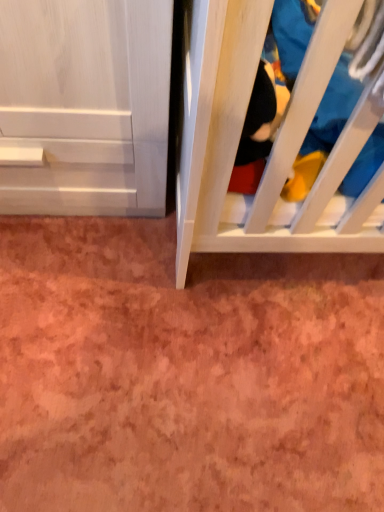
This screenshot has height=512, width=384. Describe the element at coordinates (273, 146) in the screenshot. I see `wooden crib at right` at that location.

Locate an element on the screen. The height and width of the screenshot is (512, 384). wooden crib at right is located at coordinates (273, 146).

This screenshot has width=384, height=512. Identify the location of blue cotton shirt at right. tap(333, 109).

The height and width of the screenshot is (512, 384). Describe the element at coordinates (333, 109) in the screenshot. I see `blue cotton shirt at right` at that location.

Find the location of `wooden crib at right`. wooden crib at right is located at coordinates (273, 146).

Based on their positions, is blue cotton shirt at right located to the left or right of wooden crib at right?

From the image, it's evident that blue cotton shirt at right is to the right of wooden crib at right.

Between blue cotton shirt at right and wooden crib at right, which one is positioned in front?

wooden crib at right is more forward.

Is point (271, 21) positioned before point (215, 47)?

No.

From the image's perspective, is blue cotton shirt at right located above wooden crib at right?

Indeed, from the image's perspective, blue cotton shirt at right is shown above wooden crib at right.

From a real-world perspective, which is physically above, blue cotton shirt at right or wooden crib at right?

wooden crib at right is physically above.

Considering the relative sizes of blue cotton shirt at right and wooden crib at right in the image provided, is blue cotton shirt at right wider than wooden crib at right?

Yes, blue cotton shirt at right is wider than wooden crib at right.

Who is shorter, blue cotton shirt at right or wooden crib at right?

blue cotton shirt at right.

Does blue cotton shirt at right have a larger size compared to wooden crib at right?

Correct, blue cotton shirt at right is larger in size than wooden crib at right.

Do you think blue cotton shirt at right is within wooden crib at right, or outside of it?

blue cotton shirt at right cannot be found inside wooden crib at right.

Are blue cotton shirt at right and wooden crib at right making contact?

No.

Could you tell me if blue cotton shirt at right is facing wooden crib at right?

No, blue cotton shirt at right does not turn towards wooden crib at right.

What's the angular difference between blue cotton shirt at right and wooden crib at right's facing directions?

0.00132 degrees.

Measure the distance from blue cotton shirt at right to wooden crib at right.

blue cotton shirt at right is 7.83 inches away from wooden crib at right.

In the image, there is a blue cotton shirt at right. In order to click on furniture below it (from the image's perspective) in this screenshot , I will do `click(273, 146)`.

Consider the image. Considering the relative positions of wooden crib at right and blue cotton shirt at right in the image provided, is wooden crib at right to the right of blue cotton shirt at right from the viewer's perspective?

Incorrect, wooden crib at right is not on the right side of blue cotton shirt at right.

Is wooden crib at right behind blue cotton shirt at right?

No, wooden crib at right is closer to the viewer.

Which is in front, point (205, 73) or point (327, 101)?

The point (205, 73) is more forward.

From the image's perspective, relative to blue cotton shirt at right, is wooden crib at right above or below?

wooden crib at right is below blue cotton shirt at right.

From a real-world perspective, is wooden crib at right positioned above or below blue cotton shirt at right?

Clearly, from a real-world perspective, wooden crib at right is above blue cotton shirt at right.

Considering the relative sizes of wooden crib at right and blue cotton shirt at right in the image provided, is wooden crib at right thinner than blue cotton shirt at right?

Yes, wooden crib at right is thinner than blue cotton shirt at right.

Looking at this image, who is shorter, wooden crib at right or blue cotton shirt at right?

blue cotton shirt at right is shorter.

Considering the sizes of objects wooden crib at right and blue cotton shirt at right in the image provided, who is smaller, wooden crib at right or blue cotton shirt at right?

wooden crib at right is smaller.

Is wooden crib at right inside or outside of blue cotton shirt at right?

wooden crib at right is enclosed within blue cotton shirt at right.

Is wooden crib at right next to blue cotton shirt at right and touching it?

wooden crib at right is not next to blue cotton shirt at right, and they're not touching.

Is wooden crib at right turned away from blue cotton shirt at right?

Yes, wooden crib at right's orientation is away from blue cotton shirt at right.

I want to click on furniture lying on the left of blue cotton shirt at right, so click(x=273, y=146).

Find the location of `furniture in front of the blue cotton shirt at right`. furniture in front of the blue cotton shirt at right is located at coordinates (273, 146).

Image resolution: width=384 pixels, height=512 pixels. I want to click on clothing below the wooden crib at right (from a real-world perspective), so click(x=333, y=109).